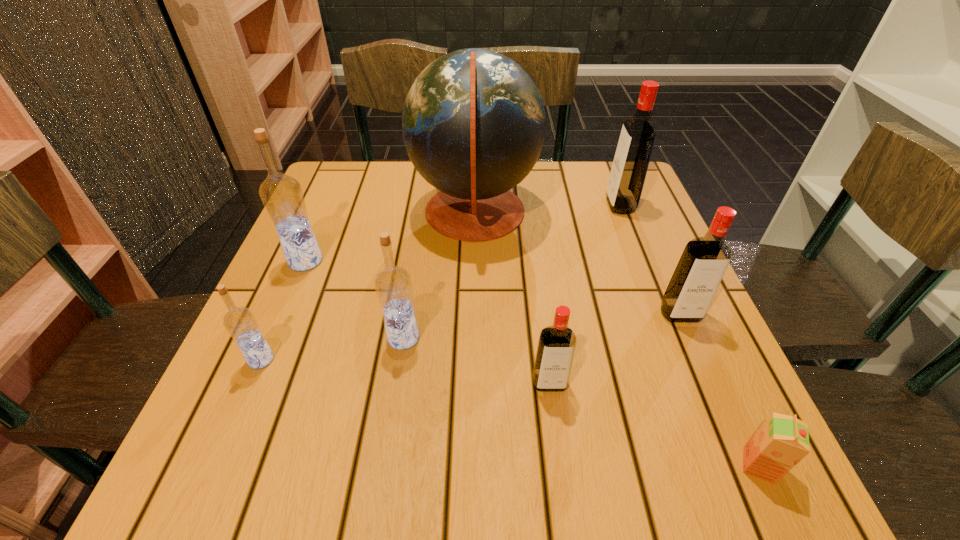
Find the location of `the nearest red vodka`. the nearest red vodka is located at coordinates (556, 346).

You are a GUI agent. You are given a task and a screenshot of the screen. Output one action in this format:
    pyautogui.click(x=<x>, y=<y>)
    Task: Click on the smallest blue vodka
    Image resolution: width=960 pixels, height=540 pixels.
    Given the screenshot: What is the action you would take?
    pyautogui.click(x=240, y=322)

Identify the location of the nearest object. (782, 441).

Where is `orange juice`? orange juice is located at coordinates (782, 441).

This screenshot has width=960, height=540. Identify the location of vacant area situated 0.070m with the Americas facing the viewer on the globe. (566, 214).

You are a GUI agent. You are given a task and a screenshot of the screen. Output one action in this format:
    pyautogui.click(x=<x>, y=<y>)
    Task: Click on the free space located on the right of the farthest blue vodka
    This screenshot has width=960, height=540.
    Given the screenshot: What is the action you would take?
    pyautogui.click(x=383, y=261)

Where is `blank space located 0.250m on the front and back of the biggest red vodka`? The width and height of the screenshot is (960, 540). blank space located 0.250m on the front and back of the biggest red vodka is located at coordinates (507, 205).

You are a GUI agent. You are given a task and a screenshot of the screen. Output one action in this format:
    pyautogui.click(x=<x>, y=<y>)
    Task: Click on the free spot located on the front and back of the biggest red vodka
    The width and height of the screenshot is (960, 540).
    Given the screenshot: What is the action you would take?
    pyautogui.click(x=543, y=205)

Image resolution: width=960 pixels, height=540 pixels. I want to click on blank space located 0.120m on the front and back of the biggest red vodka, so click(x=559, y=205).

You are a GUI agent. You are given a task and a screenshot of the screen. Output one action in this format:
    pyautogui.click(x=<x>, y=<y>)
    Task: Click on the vacant region located on the right of the second smallest blue vodka
    
    Given the screenshot: What is the action you would take?
    pyautogui.click(x=589, y=338)